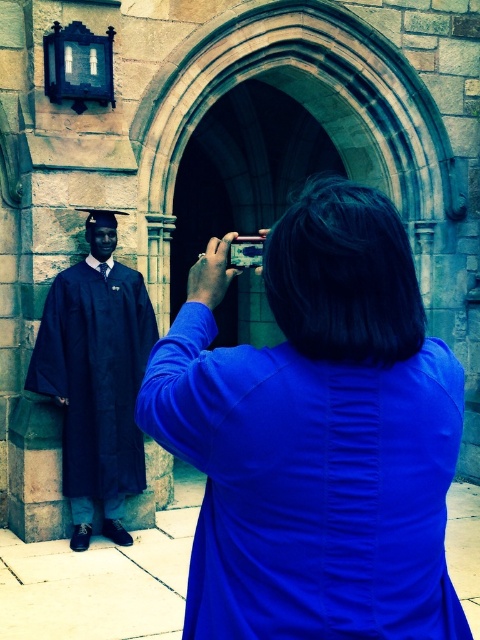
Does blue fabric shirt at center lie in front of matte black gown at left?

Yes, blue fabric shirt at center is in front of matte black gown at left.

Does point (326, 195) lie behind point (107, 282)?

That is False.

Between point (314, 449) and point (107, 394), which one is positioned behind?

The point (107, 394) is behind.

Identify the location of blue fabric shirt at center. (315, 435).